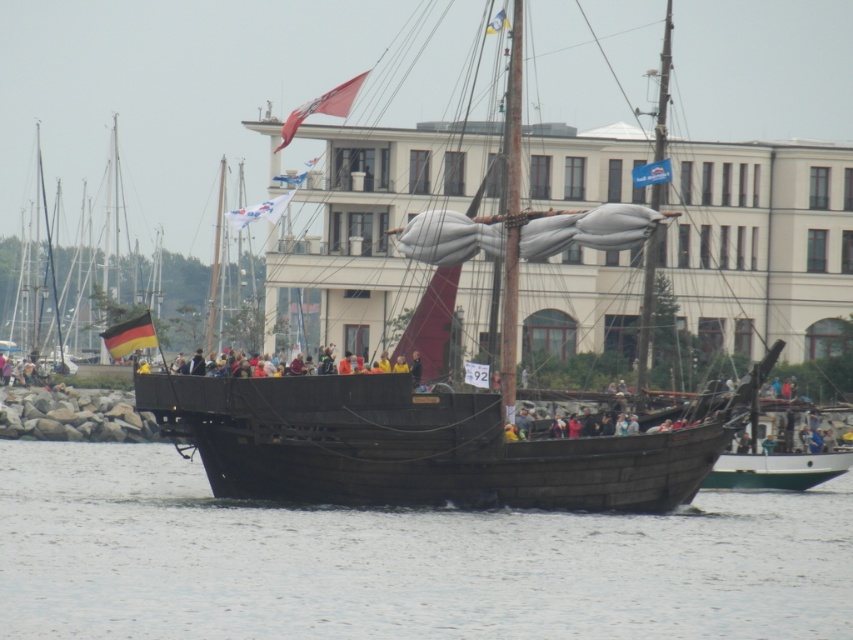
Question: From the image, what is the correct spatial relationship of white fabric flag at center in relation to yellow fabric flag at upper center?

Choices:
 (A) right
 (B) left

Answer: (B)

Question: Which point is closer to the camera taking this photo?

Choices:
 (A) (289, 134)
 (B) (227, 371)
 (C) (144, 330)
 (D) (258, 218)

Answer: (B)

Question: Which of the following is the closest to the observer?

Choices:
 (A) yellow fabric people at center
 (B) white fabric flag at center

Answer: (A)

Question: Observing the image, what is the correct spatial positioning of smooth water at center in reference to yellow fabric people at center?

Choices:
 (A) below
 (B) above

Answer: (A)

Question: Considering the real-world distances, which object is farthest from the wooden pirate ship at center?

Choices:
 (A) yellow-red-yellow flag at center
 (B) smooth water at center

Answer: (A)

Question: Does yellow-red-yellow flag at center have a larger size compared to yellow fabric people at center?

Choices:
 (A) no
 (B) yes

Answer: (B)